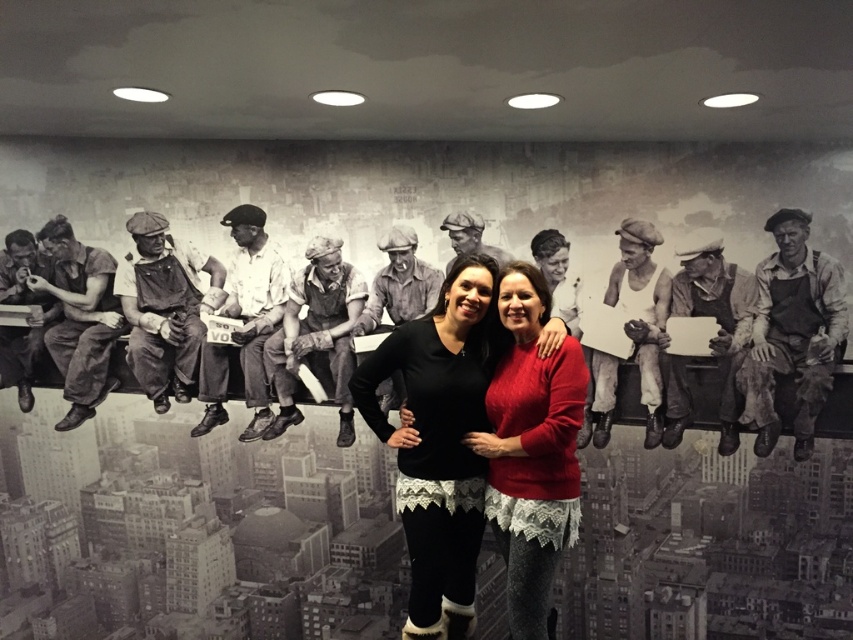
Question: Considering the real-world distances, which object is closest to the matte black overalls at center?

Choices:
 (A) matte black overalls at left
 (B) brown leather apron at right

Answer: (B)

Question: Where is red sweater at center located in relation to matte gray hard hat at center in the image?

Choices:
 (A) above
 (B) below

Answer: (B)

Question: Is black lace top at center in front of matte gray hard hat at center?

Choices:
 (A) no
 (B) yes

Answer: (B)

Question: Which object is closer to the camera taking this photo?

Choices:
 (A) matte gray hard hat at center
 (B) black lace top at center

Answer: (B)

Question: Which object is positioned farthest from the matte gray hard hat at center?

Choices:
 (A) brown leather apron at right
 (B) matte black overalls at left
 (C) dark gray fabric overalls at left
 (D) matte black overalls at center

Answer: (B)

Question: Is red sweater at center smaller than matte gray overalls at center?

Choices:
 (A) no
 (B) yes

Answer: (A)